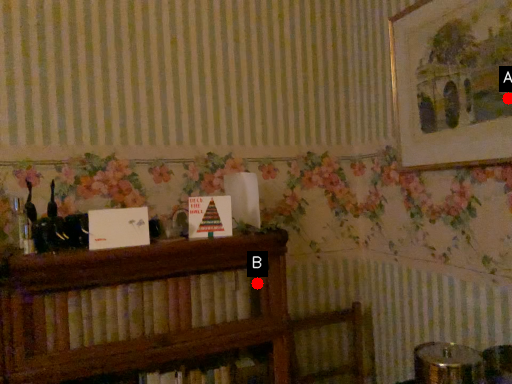
Question: Two points are circled on the image, labeled by A and B beside each circle. Which point is further to the camera?

Choices:
 (A) A is further
 (B) B is further

Answer: (B)